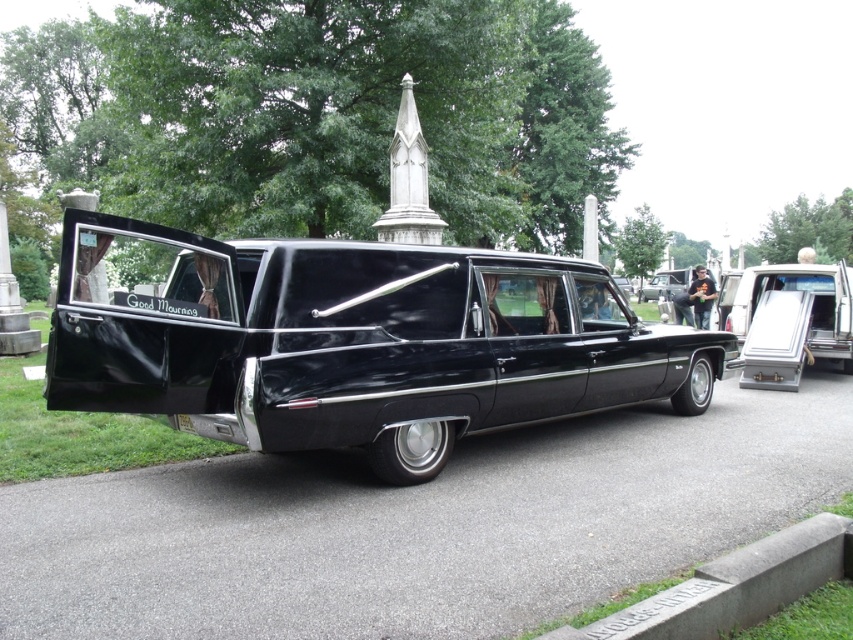
Between black glossy hearse at center and metallic silver casket at center, which one has less height?

black glossy hearse at center is shorter.

Can you confirm if black glossy hearse at center is smaller than metallic silver casket at center?

Yes.

Is point (222, 422) in front of point (757, 268)?

Yes, point (222, 422) is in front of point (757, 268).

The image size is (853, 640). Find the location of `black glossy hearse at center`. black glossy hearse at center is located at coordinates (354, 339).